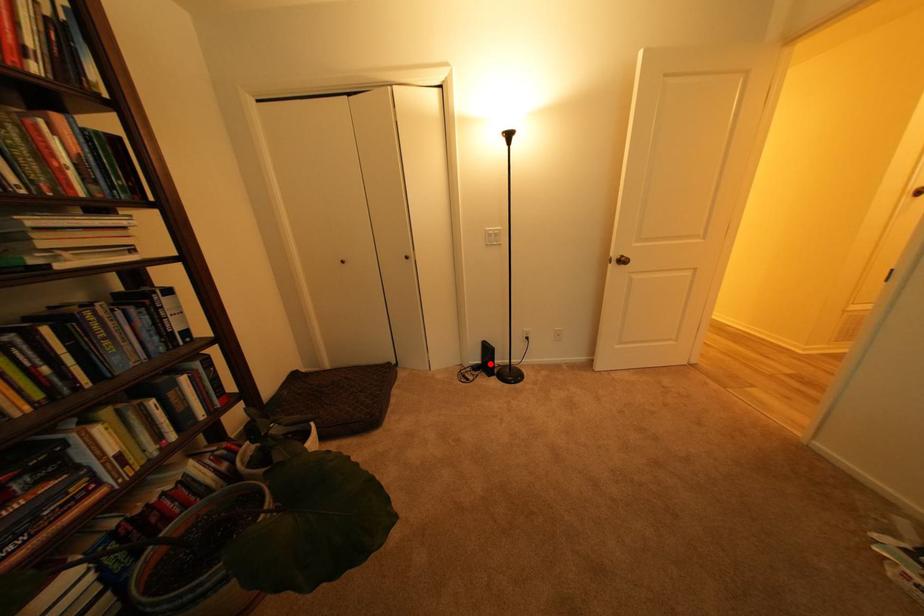
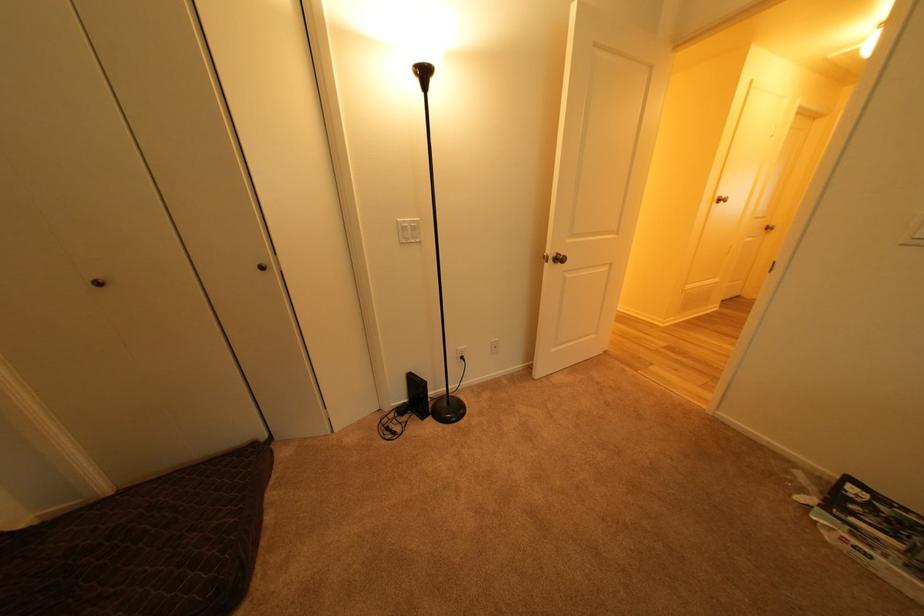
Question: A red point is marked in image1. In image2, is the corresponding 3D point closer to the camera or farther? Reply with the corresponding letter.

Choices:
 (A) The corresponding 3D point is closer.
 (B) The corresponding 3D point is farther.

Answer: (B)